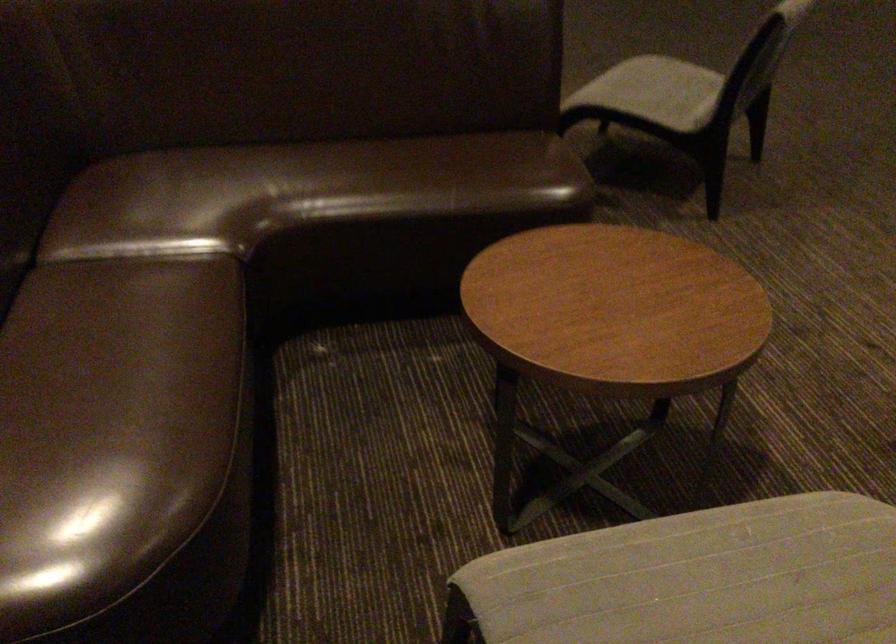
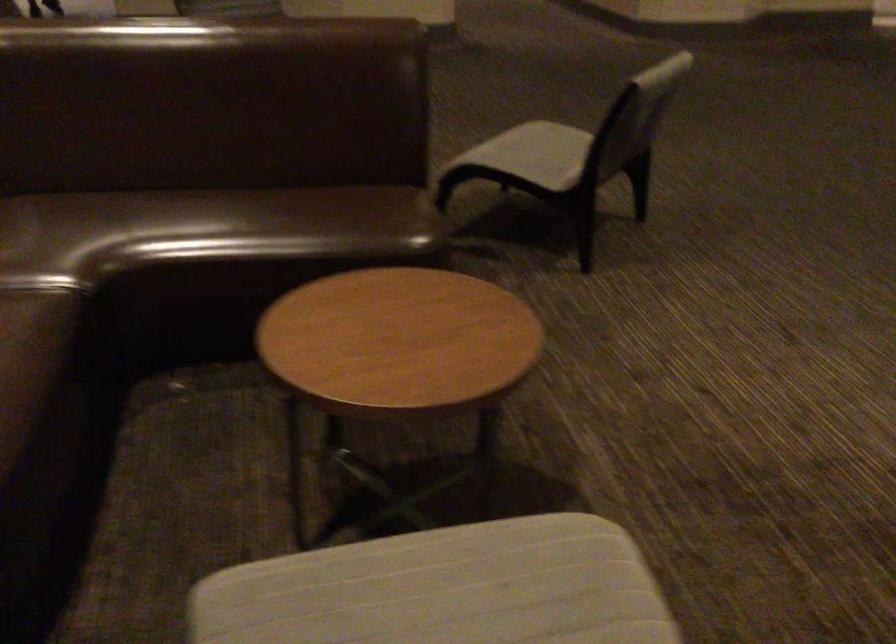
Question: How did the camera likely rotate?

Choices:
 (A) Left
 (B) Right
 (C) Up
 (D) Down

Answer: (C)